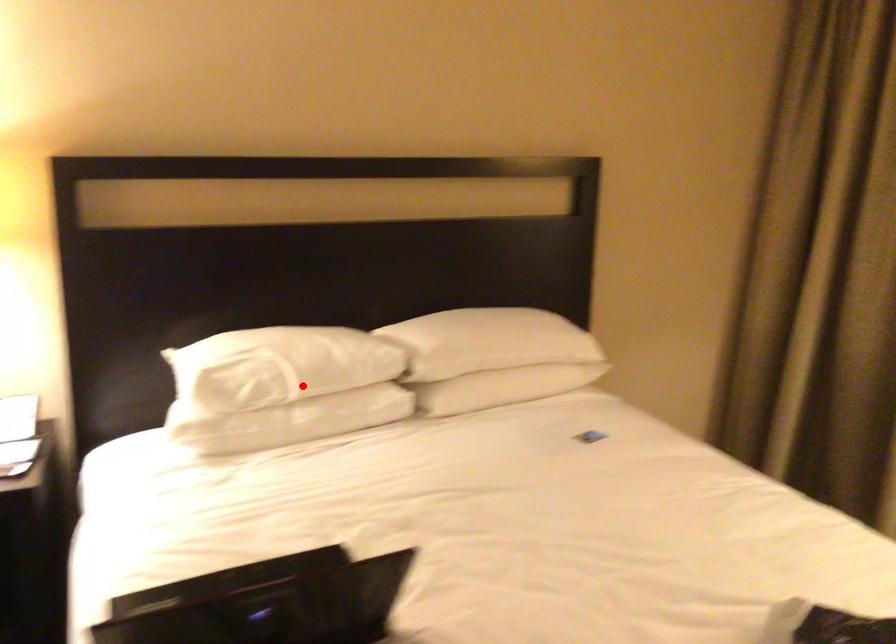
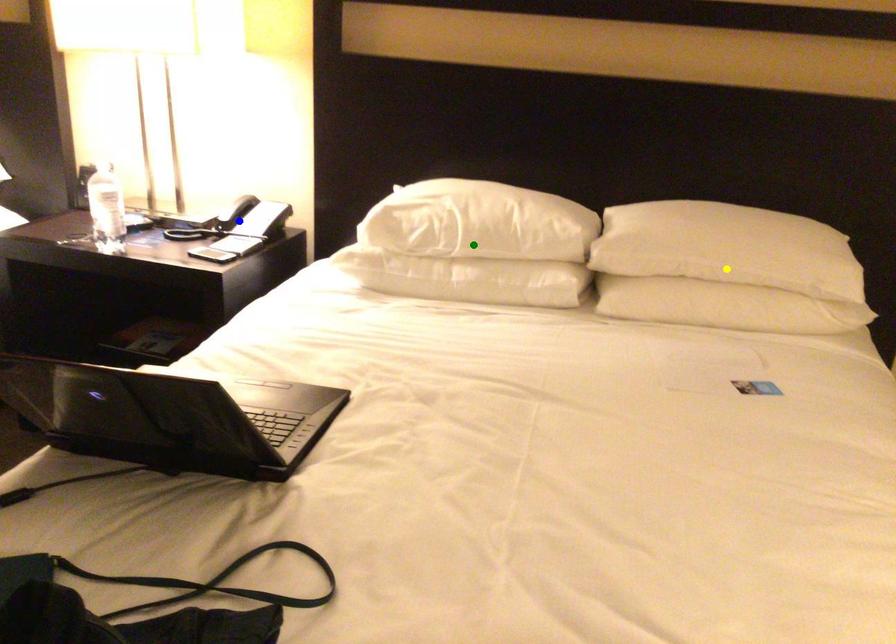
Question: I am providing you with two images of the same scene from different viewpoints. A red point is marked on the first image. You are given multiple points on the second image. Can you choose the point in image 2 that corresponds to the point in image 1?

Choices:
 (A) yellow point
 (B) blue point
 (C) green point

Answer: (C)